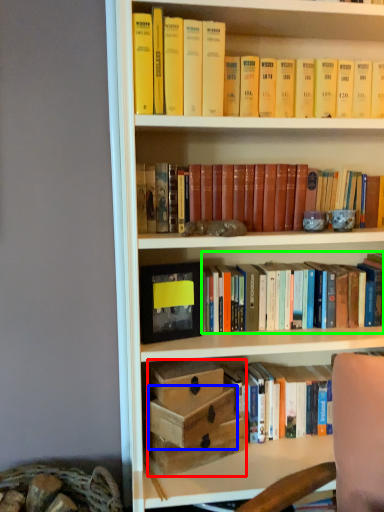
Question: Which is nearer to the box (highlighted by a red box)? box (highlighted by a blue box) or book (highlighted by a green box).

Choices:
 (A) box
 (B) book

Answer: (A)